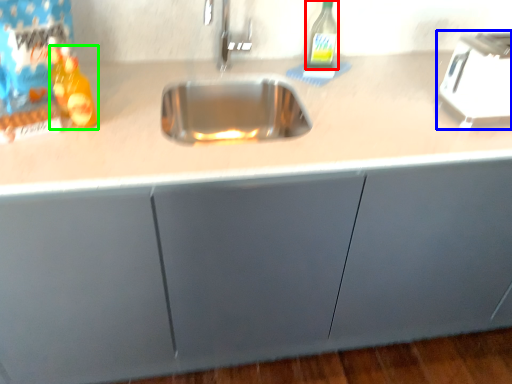
Question: Based on their relative distances, which object is nearer to bottle (highlighted by a red box)? Choose from appliance (highlighted by a blue box) and bottle (highlighted by a green box).

Choices:
 (A) appliance
 (B) bottle

Answer: (A)